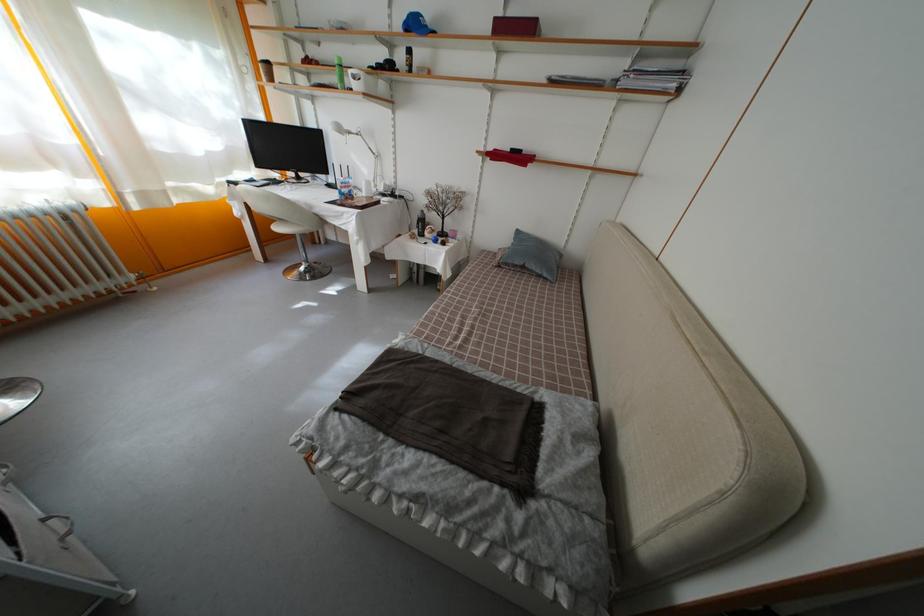
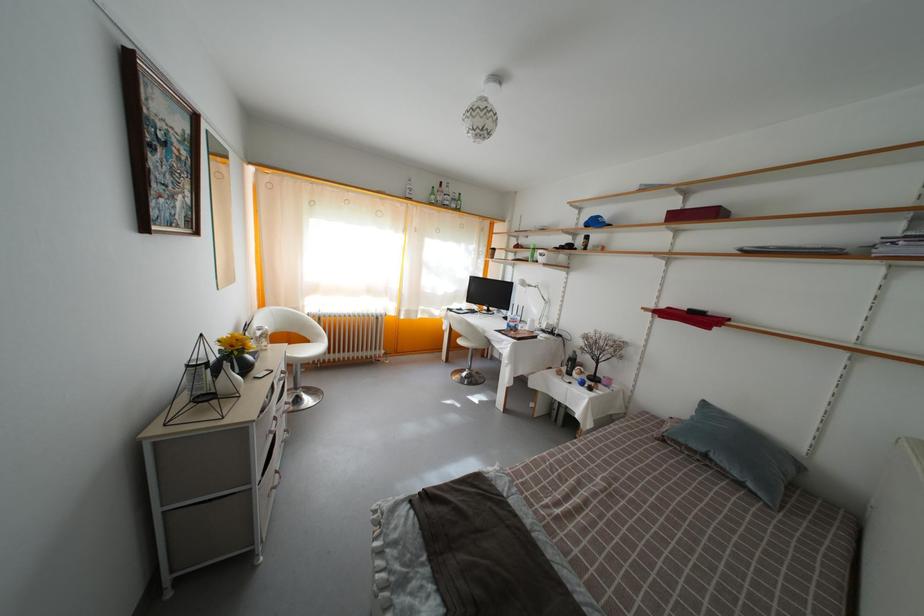
Locate, in the second image, the point that corresponds to pixel 542 26 in the first image.

(724, 214)